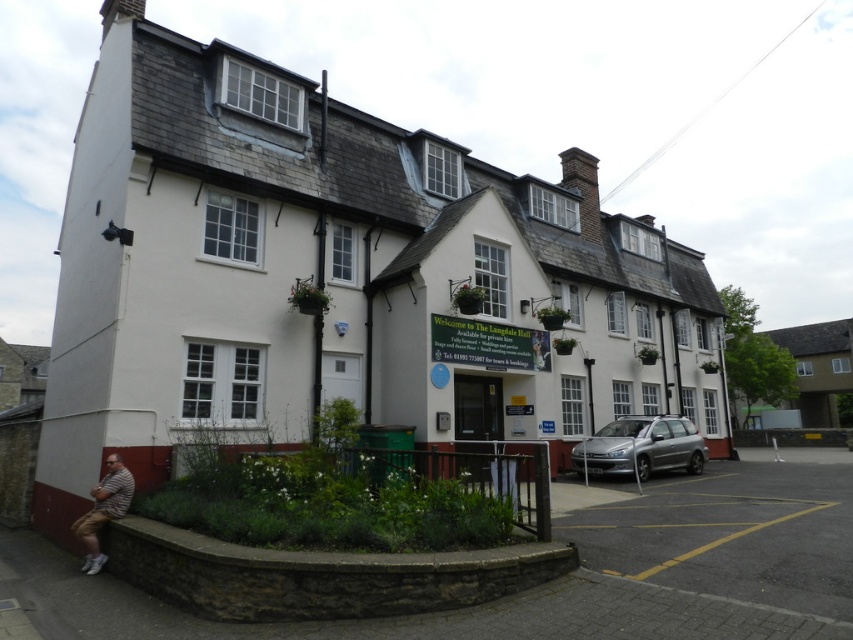
You are standing at the entrance of the building and see the satin silver car at lower right. If you want to take a photo of the car using a camera that has a maximum range of 50 feet, will you be able to capture the car clearly?

The satin silver car at lower right and camera are 47.10 feet apart. Since the camera has a maximum range of 50 feet, you can capture the car clearly as the distance is within the camera range.

You are standing in front of the building and want to take a photo of both the satin silver car at lower right and the striped fabric at lower left. Which object should you position closer to the camera to include both in the frame?

You should position the satin silver car at lower right closer to the camera since it is already closer to the viewer than the striped fabric at lower left, allowing both to be captured in the frame.

You are a visitor approaching the entrance of the two story building. You see a satin silver car at lower right and a striped fabric at lower left. Which object is closer to the entrance?

The satin silver car at lower right is located below striped fabric at lower left, so the striped fabric at lower left is closer to the entrance since it is positioned higher up and nearer to the building entrance.